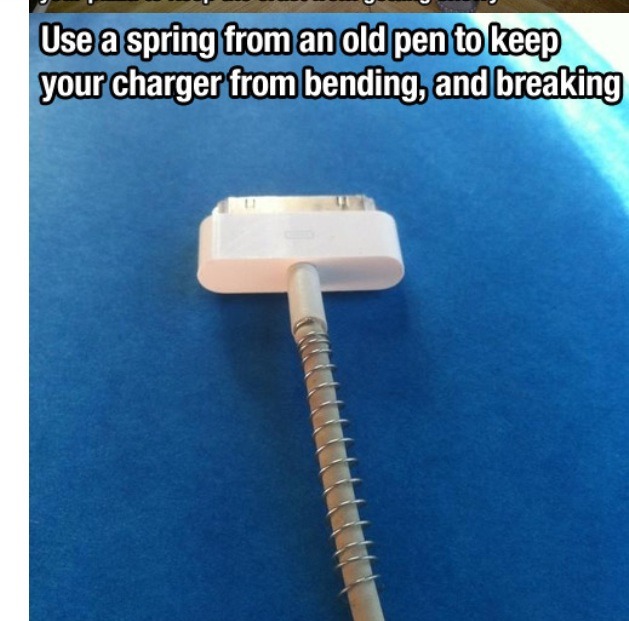
Where is `table`? The width and height of the screenshot is (629, 621). table is located at coordinates (251, 4).